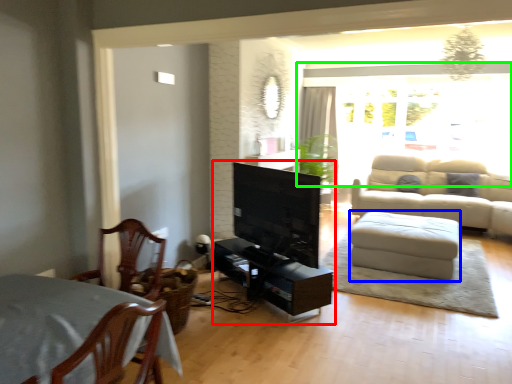
Question: Based on their relative distances, which object is nearer to entertainment center (highlighted by a red box)? Choose from footrest (highlighted by a blue box) and window (highlighted by a green box).

Choices:
 (A) footrest
 (B) window

Answer: (A)